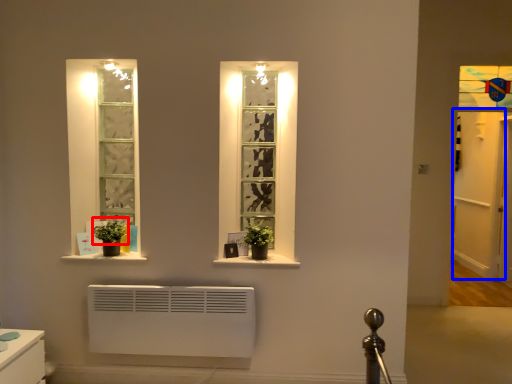
Question: Which point is further to the camera, plant (highlighted by a red box) or glass door (highlighted by a blue box)?

Choices:
 (A) plant
 (B) glass door

Answer: (B)